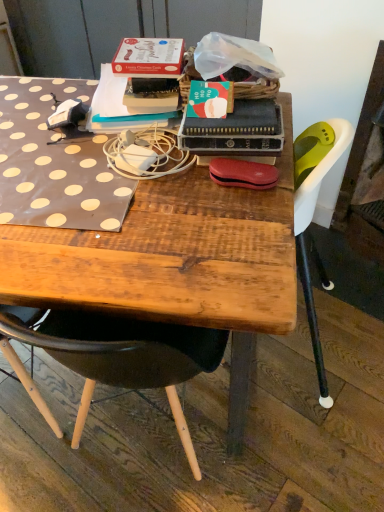
Identify the location of vacant region to the left of matte red pouch at center. The width and height of the screenshot is (384, 512). (169, 193).